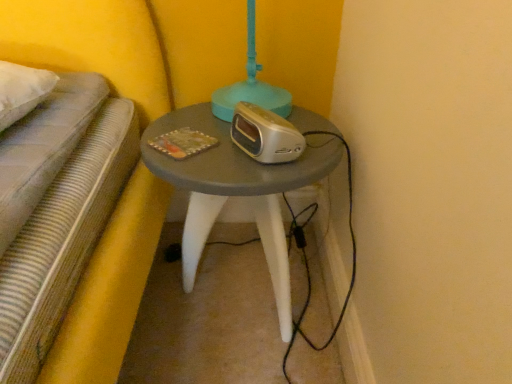
Question: Is silver metallic alarm clock at center bigger or smaller than matte gray table at center?

Choices:
 (A) big
 (B) small

Answer: (B)

Question: Considering the relative positions of silver metallic alarm clock at center and matte gray table at center in the image provided, is silver metallic alarm clock at center to the left or to the right of matte gray table at center?

Choices:
 (A) right
 (B) left

Answer: (A)

Question: Is silver metallic alarm clock at center in front of or behind matte gray table at center in the image?

Choices:
 (A) behind
 (B) front

Answer: (B)

Question: Which is correct: matte gray table at center is inside silver metallic alarm clock at center, or outside of it?

Choices:
 (A) inside
 (B) outside

Answer: (B)

Question: In the image, is matte gray table at center positioned in front of or behind silver metallic alarm clock at center?

Choices:
 (A) behind
 (B) front

Answer: (A)

Question: Based on their sizes in the image, would you say matte gray table at center is bigger or smaller than silver metallic alarm clock at center?

Choices:
 (A) big
 (B) small

Answer: (A)

Question: Based on their positions, is matte gray table at center located to the left or right of silver metallic alarm clock at center?

Choices:
 (A) right
 (B) left

Answer: (B)